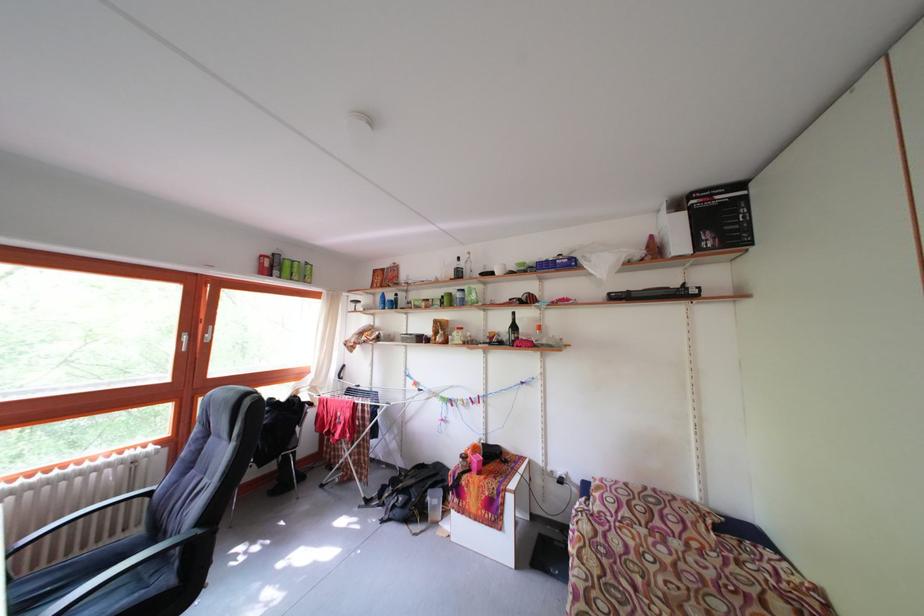
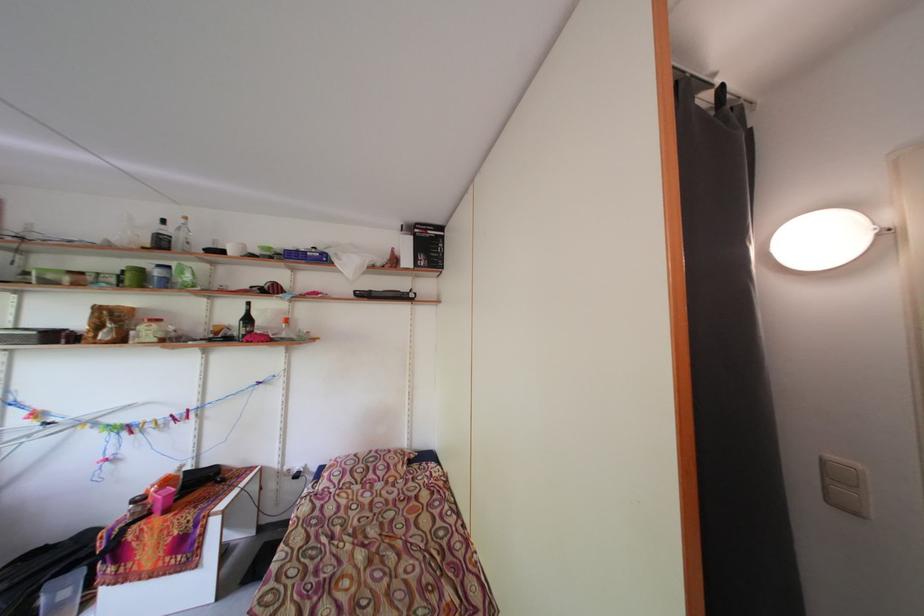
Locate, in the second image, the point that corresponds to [469,270] in the first image.

(176, 236)